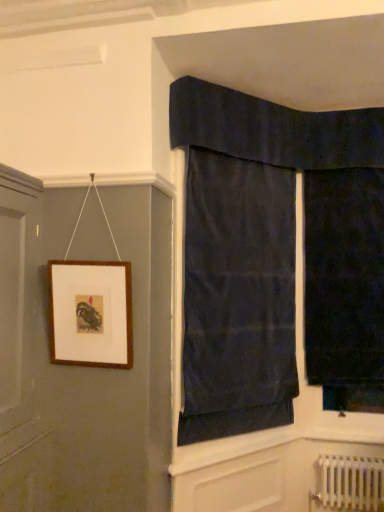
Describe the element at coordinates (237, 297) in the screenshot. I see `dark blue fabric at upper center, marked as the 2th curtain in a right-to-left arrangement` at that location.

The image size is (384, 512). Describe the element at coordinates (350, 484) in the screenshot. I see `white metallic radiator at lower right` at that location.

What do you see at coordinates (345, 287) in the screenshot? Image resolution: width=384 pixels, height=512 pixels. I see `dark velvet curtain at right, the second curtain in the left-to-right sequence` at bounding box center [345, 287].

Identify the location of dark blue fabric at upper center, marked as the 2th curtain in a right-to-left arrangement. (237, 297).

Find the location of a particular element. The height and width of the screenshot is (512, 384). picture frame below the dark velvet curtain at right, the second curtain in the left-to-right sequence (from the image's perspective) is located at coordinates (91, 313).

Does point (109, 316) come in front of point (347, 352)?

Yes, it is in front of point (347, 352).

Could you tell me if brown wooden picture frame at upper left is facing dark velvet curtain at right, the first curtain when ordered from right to left?

No, brown wooden picture frame at upper left is not oriented towards dark velvet curtain at right, the first curtain when ordered from right to left.

How distant is brown wooden picture frame at upper left from dark velvet curtain at right, the second curtain in the left-to-right sequence?

brown wooden picture frame at upper left and dark velvet curtain at right, the second curtain in the left-to-right sequence, are 5.24 feet apart.

Would you say brown wooden picture frame at upper left is a long distance from dark blue fabric at upper center, the 1th curtain from the left?

They are positioned close to each other.

Would you say brown wooden picture frame at upper left is inside or outside dark blue fabric at upper center, marked as the 2th curtain in a right-to-left arrangement?

brown wooden picture frame at upper left lies outside dark blue fabric at upper center, marked as the 2th curtain in a right-to-left arrangement.

Considering the points (127, 308) and (202, 267), which point is in front, point (127, 308) or point (202, 267)?

The point (127, 308) is in front.

Is brown wooden picture frame at upper left closer to camera compared to dark blue fabric at upper center, marked as the 2th curtain in a right-to-left arrangement?

Yes, it is in front of dark blue fabric at upper center, marked as the 2th curtain in a right-to-left arrangement.

Considering the relative positions of dark blue fabric at upper center, the 1th curtain from the left, and white metallic radiator at lower right in the image provided, is dark blue fabric at upper center, the 1th curtain from the left, to the left of white metallic radiator at lower right from the viewer's perspective?

Yes.

From a real-world perspective, which is physically above, dark blue fabric at upper center, marked as the 2th curtain in a right-to-left arrangement, or white metallic radiator at lower right?

dark blue fabric at upper center, marked as the 2th curtain in a right-to-left arrangement, is physically above.

In terms of height, does dark blue fabric at upper center, the 1th curtain from the left, look taller or shorter compared to white metallic radiator at lower right?

Considering their sizes, dark blue fabric at upper center, the 1th curtain from the left, has more height than white metallic radiator at lower right.

Is white metallic radiator at lower right spatially inside dark velvet curtain at right, the second curtain in the left-to-right sequence, or outside of it?

The correct answer is: outside.

Considering the sizes of white metallic radiator at lower right and dark velvet curtain at right, the first curtain when ordered from right to left, in the image, is white metallic radiator at lower right wider or thinner than dark velvet curtain at right, the first curtain when ordered from right to left,?

Considering their sizes, white metallic radiator at lower right looks slimmer than dark velvet curtain at right, the first curtain when ordered from right to left.

In the scene shown: From the image's perspective, which object appears higher, white metallic radiator at lower right or dark velvet curtain at right, the second curtain in the left-to-right sequence?

dark velvet curtain at right, the second curtain in the left-to-right sequence, from the image's perspective.

Looking at this image, would you say white metallic radiator at lower right is a long distance from dark velvet curtain at right, the second curtain in the left-to-right sequence?

No, white metallic radiator at lower right is not far from dark velvet curtain at right, the second curtain in the left-to-right sequence.

Does white metallic radiator at lower right contain brown wooden picture frame at upper left?

No, brown wooden picture frame at upper left is not surrounded by white metallic radiator at lower right.

I want to click on radiator behind the brown wooden picture frame at upper left, so 350,484.

Does point (337, 498) come behind point (87, 275)?

That is True.

Is white metallic radiator at lower right with brown wooden picture frame at upper left?

white metallic radiator at lower right and brown wooden picture frame at upper left are clearly separated.

Is dark velvet curtain at right, the second curtain in the left-to-right sequence, to the left or to the right of brown wooden picture frame at upper left in the image?

dark velvet curtain at right, the second curtain in the left-to-right sequence, is positioned on brown wooden picture frame at upper left's right side.

From the image's perspective, which one is positioned higher, dark velvet curtain at right, the second curtain in the left-to-right sequence, or brown wooden picture frame at upper left?

dark velvet curtain at right, the second curtain in the left-to-right sequence.

Would you say brown wooden picture frame at upper left is part of dark velvet curtain at right, the first curtain when ordered from right to left,'s contents?

No, brown wooden picture frame at upper left is not inside dark velvet curtain at right, the first curtain when ordered from right to left.

Is white metallic radiator at lower right turned away from dark blue fabric at upper center, marked as the 2th curtain in a right-to-left arrangement?

No.

Is white metallic radiator at lower right taller than dark blue fabric at upper center, marked as the 2th curtain in a right-to-left arrangement?

No, white metallic radiator at lower right is not taller than dark blue fabric at upper center, marked as the 2th curtain in a right-to-left arrangement.

Considering the relative sizes of white metallic radiator at lower right and dark blue fabric at upper center, marked as the 2th curtain in a right-to-left arrangement, in the image provided, is white metallic radiator at lower right wider than dark blue fabric at upper center, marked as the 2th curtain in a right-to-left arrangement,?

Yes, white metallic radiator at lower right is wider than dark blue fabric at upper center, marked as the 2th curtain in a right-to-left arrangement.

Image resolution: width=384 pixels, height=512 pixels. What are the coordinates of `radiator that appears on the right of dark blue fabric at upper center, the 1th curtain from the left` in the screenshot? It's located at (350, 484).

The image size is (384, 512). In order to click on the 1st curtain positioned above the brown wooden picture frame at upper left (from the image's perspective) in this screenshot , I will do `click(345, 287)`.

You are a GUI agent. You are given a task and a screenshot of the screen. Output one action in this format:
    pyautogui.click(x=<x>, y=<y>)
    Task: Click on the picture frame located underneath the dark blue fabric at upper center, marked as the 2th curtain in a right-to-left arrangement (from a real-world perspective)
    The width and height of the screenshot is (384, 512).
    Given the screenshot: What is the action you would take?
    pyautogui.click(x=91, y=313)

Estimate the real-world distances between objects in this image. Which object is further from white metallic radiator at lower right, dark blue fabric at upper center, marked as the 2th curtain in a right-to-left arrangement, or dark velvet curtain at right, the second curtain in the left-to-right sequence?

dark blue fabric at upper center, marked as the 2th curtain in a right-to-left arrangement.

From the image, which object appears to be nearer to dark blue fabric at upper center, the 1th curtain from the left, brown wooden picture frame at upper left or white metallic radiator at lower right?

brown wooden picture frame at upper left.

When comparing their distances from dark velvet curtain at right, the first curtain when ordered from right to left, does dark blue fabric at upper center, marked as the 2th curtain in a right-to-left arrangement, or white metallic radiator at lower right seem closer?

dark blue fabric at upper center, marked as the 2th curtain in a right-to-left arrangement.

Which object lies further to the anchor point dark blue fabric at upper center, marked as the 2th curtain in a right-to-left arrangement, white metallic radiator at lower right or brown wooden picture frame at upper left?

Among the two, white metallic radiator at lower right is located further to dark blue fabric at upper center, marked as the 2th curtain in a right-to-left arrangement.

Which object lies nearer to the anchor point dark velvet curtain at right, the second curtain in the left-to-right sequence, white metallic radiator at lower right or dark blue fabric at upper center, marked as the 2th curtain in a right-to-left arrangement?

dark blue fabric at upper center, marked as the 2th curtain in a right-to-left arrangement, is positioned closer to the anchor dark velvet curtain at right, the second curtain in the left-to-right sequence.

Considering their positions, is dark velvet curtain at right, the second curtain in the left-to-right sequence, positioned closer to dark blue fabric at upper center, marked as the 2th curtain in a right-to-left arrangement, than brown wooden picture frame at upper left?

Based on the image, dark velvet curtain at right, the second curtain in the left-to-right sequence, appears to be nearer to dark blue fabric at upper center, marked as the 2th curtain in a right-to-left arrangement.

Estimate the real-world distances between objects in this image. Which object is closer to white metallic radiator at lower right, brown wooden picture frame at upper left or dark velvet curtain at right, the first curtain when ordered from right to left?

dark velvet curtain at right, the first curtain when ordered from right to left, is closer to white metallic radiator at lower right.

When comparing their distances from white metallic radiator at lower right, does dark velvet curtain at right, the first curtain when ordered from right to left, or dark blue fabric at upper center, marked as the 2th curtain in a right-to-left arrangement, seem closer?

dark velvet curtain at right, the first curtain when ordered from right to left, is positioned closer to the anchor white metallic radiator at lower right.

I want to click on curtain situated between brown wooden picture frame at upper left and dark velvet curtain at right, the first curtain when ordered from right to left, from left to right, so click(237, 297).

Find the location of `radiator situated between brown wooden picture frame at upper left and dark velvet curtain at right, the second curtain in the left-to-right sequence, from left to right`. radiator situated between brown wooden picture frame at upper left and dark velvet curtain at right, the second curtain in the left-to-right sequence, from left to right is located at coordinates (350, 484).

Image resolution: width=384 pixels, height=512 pixels. Find the location of `curtain between dark blue fabric at upper center, marked as the 2th curtain in a right-to-left arrangement, and white metallic radiator at lower right, in the vertical direction`. curtain between dark blue fabric at upper center, marked as the 2th curtain in a right-to-left arrangement, and white metallic radiator at lower right, in the vertical direction is located at coordinates (345, 287).

Locate an element on the screen. Image resolution: width=384 pixels, height=512 pixels. picture frame between dark blue fabric at upper center, the 1th curtain from the left, and white metallic radiator at lower right from top to bottom is located at coordinates (91, 313).